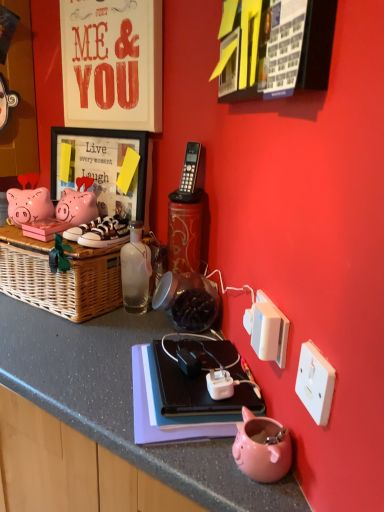
Find the location of a particular element. The image size is (384, 512). free space to the back side of white plastic power outlet at lower right, which ranks as the first power outlet in back-to-front order is located at coordinates (205, 352).